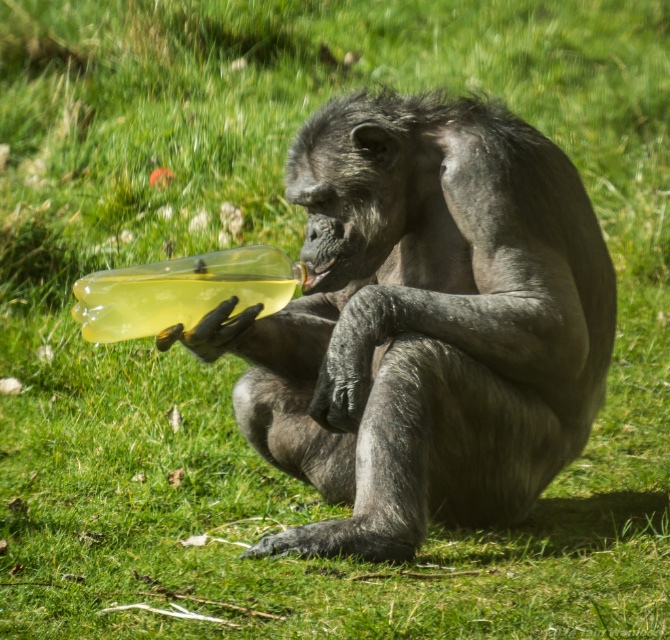
Question: Can you confirm if shiny plastic bottle at center is positioned to the right of translucent yellow bottle at lower left?

Choices:
 (A) yes
 (B) no

Answer: (A)

Question: Among these objects, which one is nearest to the camera?

Choices:
 (A) shiny plastic bottle at center
 (B) translucent yellow bottle at lower left

Answer: (B)

Question: Does shiny plastic bottle at center have a lesser width compared to translucent yellow bottle at lower left?

Choices:
 (A) no
 (B) yes

Answer: (A)

Question: Does shiny plastic bottle at center appear on the left side of translucent yellow bottle at lower left?

Choices:
 (A) no
 (B) yes

Answer: (A)

Question: Among these objects, which one is nearest to the camera?

Choices:
 (A) translucent yellow bottle at lower left
 (B) shiny plastic bottle at center

Answer: (A)